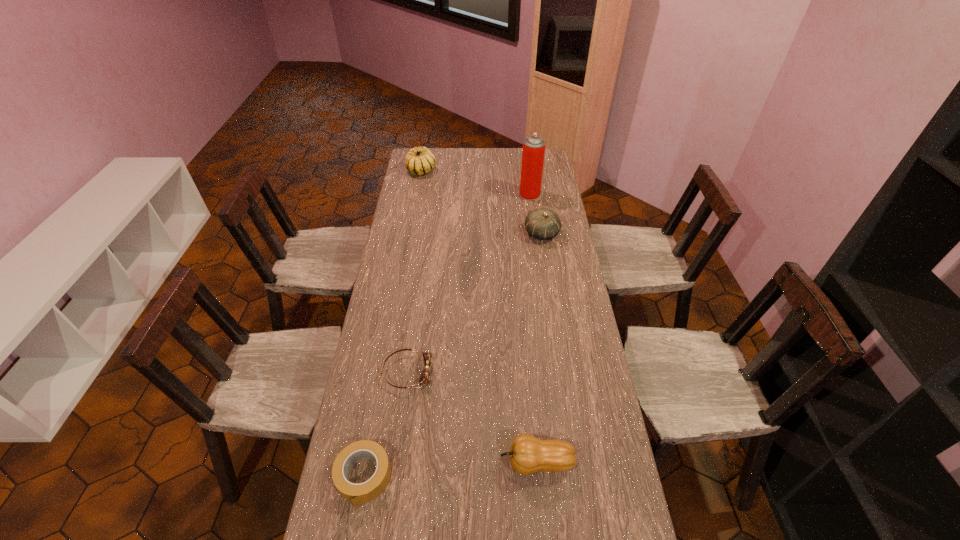
Locate an element on the screen. free space that satisfies the following two spatial constraints: 1. on the front side of the third farthest object; 2. on the stem side of the nearest gourd is located at coordinates click(577, 463).